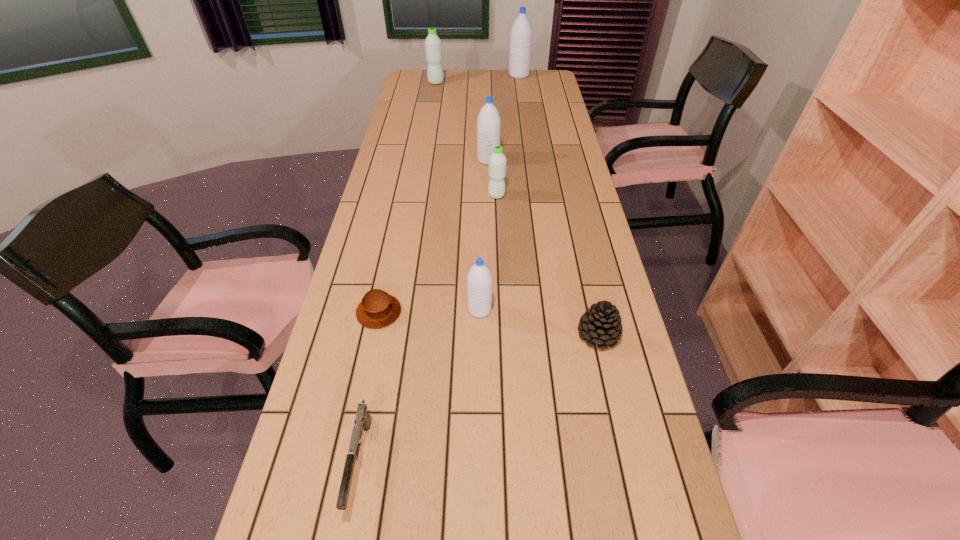
I want to click on free space at the left edge of the desktop, so click(x=370, y=219).

I want to click on free space at the right edge of the desktop, so click(x=565, y=205).

Where is `vacant space at the far left corner of the desktop`? This screenshot has width=960, height=540. vacant space at the far left corner of the desktop is located at coordinates (427, 84).

This screenshot has width=960, height=540. In order to click on free region at the far right corner of the desktop in this screenshot , I will do `click(550, 85)`.

This screenshot has height=540, width=960. What are the coordinates of `empty location between the farther green water bottle and the nearest water bottle` in the screenshot? It's located at (458, 196).

Where is `free space between the right green water bottle and the gun`? The width and height of the screenshot is (960, 540). free space between the right green water bottle and the gun is located at coordinates (428, 329).

Image resolution: width=960 pixels, height=540 pixels. Find the location of `free space between the smaller green water bottle and the sixth tallest object`. free space between the smaller green water bottle and the sixth tallest object is located at coordinates (547, 265).

Where is `vacant space that's between the fourth farthest object and the rightmost blue water bottle`? The image size is (960, 540). vacant space that's between the fourth farthest object and the rightmost blue water bottle is located at coordinates (508, 136).

In order to click on unoccupied position between the leftmost water bottle and the fourth farthest object in this screenshot , I will do `click(467, 139)`.

Locate an element on the screen. The image size is (960, 540). vacant point located between the second shortest object and the nearest water bottle is located at coordinates (420, 386).